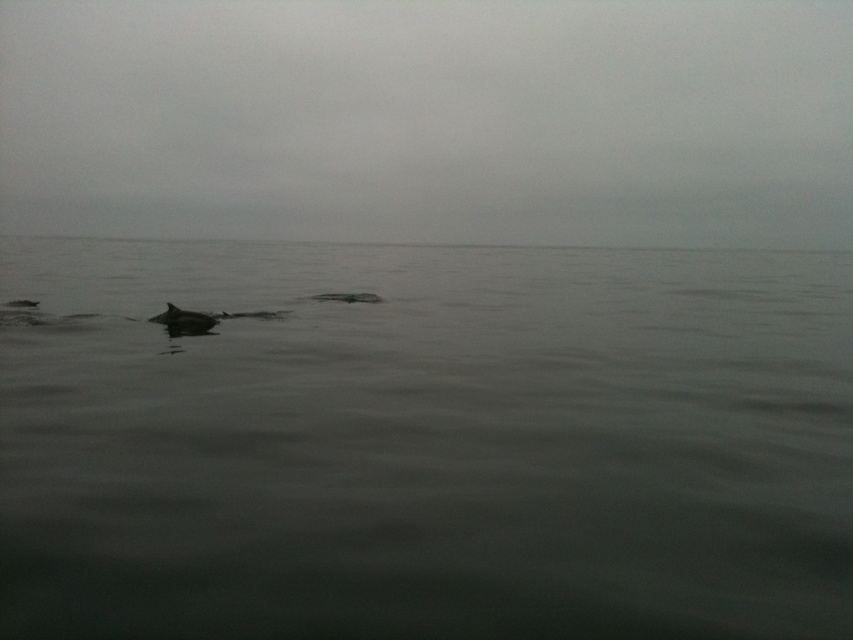
Question: Can you confirm if gray matte water at center is positioned above gray smooth dolphin at center?

Choices:
 (A) yes
 (B) no

Answer: (A)

Question: Observing the image, what is the correct spatial positioning of gray matte water at center in reference to gray smooth dolphin at center?

Choices:
 (A) above
 (B) below

Answer: (A)

Question: Among these objects, which one is farthest from the camera?

Choices:
 (A) gray smooth dolphin at center
 (B) gray matte water at center

Answer: (A)

Question: Which object is farther from the camera taking this photo?

Choices:
 (A) gray matte water at center
 (B) gray smooth dolphin at center

Answer: (B)

Question: Can you confirm if gray matte water at center is wider than gray smooth dolphin at center?

Choices:
 (A) no
 (B) yes

Answer: (B)

Question: Which of the following is the farthest from the observer?

Choices:
 (A) gray matte water at center
 (B) gray smooth dolphin at center

Answer: (B)